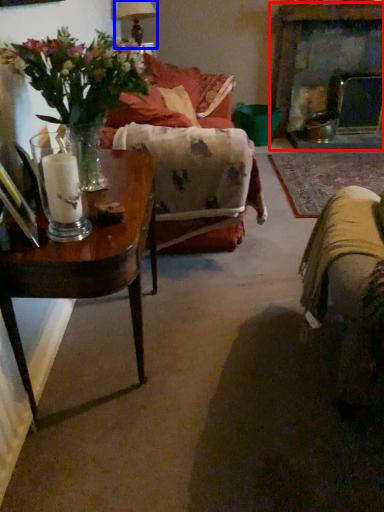
Question: Among these objects, which one is farthest to the camera, fireplace (highlighted by a red box) or lamp (highlighted by a blue box)?

Choices:
 (A) fireplace
 (B) lamp

Answer: (A)